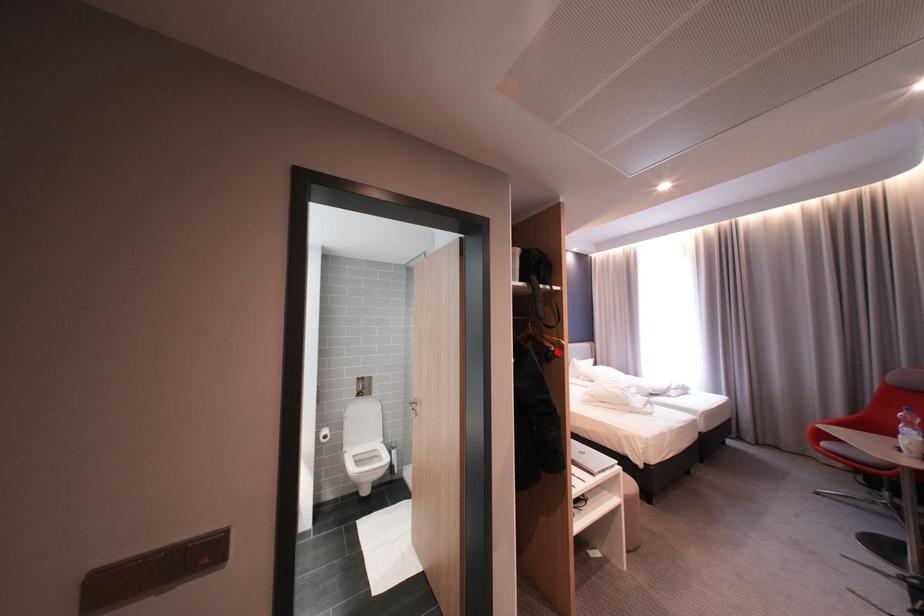
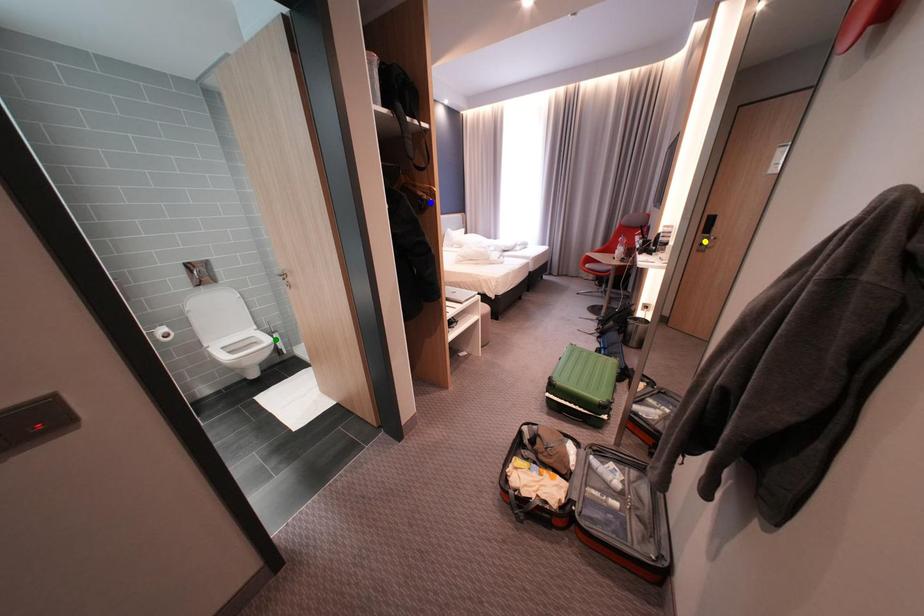
Question: I am providing you with two images of the same scene from different viewpoints. A red point is marked on the first image. You are given multiple points on the second image. Which mark in image 2 goes with the point in image 1?

Choices:
 (A) yellow point
 (B) green point
 (C) blue point

Answer: (C)